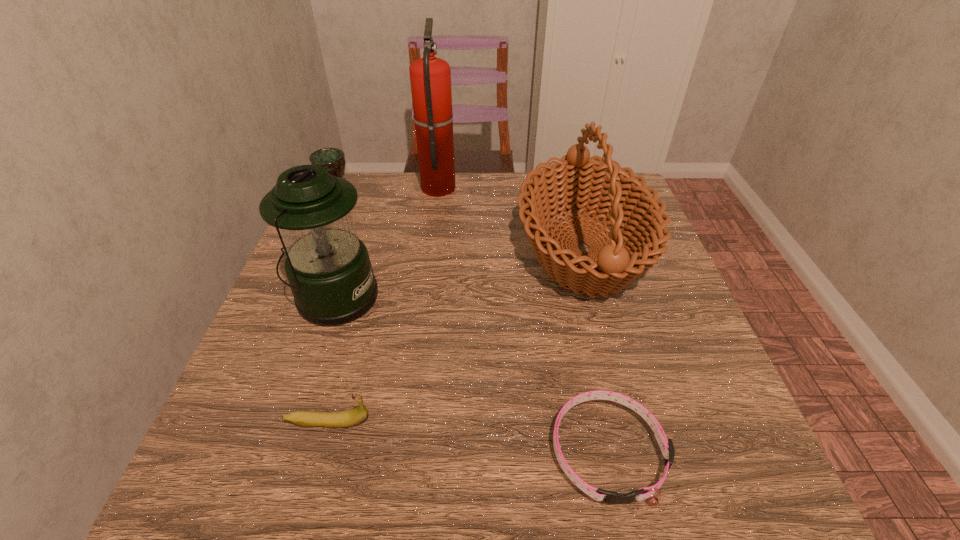
Find the location of a particular element. This screenshot has width=960, height=540. free space that is in between the chalice and the basket is located at coordinates (461, 226).

Identify the location of free space that is in between the shortest object and the banana. (468, 437).

Identify the location of empty location between the second shortest object and the basket. Image resolution: width=960 pixels, height=540 pixels. (456, 336).

This screenshot has height=540, width=960. I want to click on free point between the shortest object and the lantern, so click(471, 374).

Locate an element on the screen. Image resolution: width=960 pixels, height=540 pixels. vacant area that lies between the shortest object and the basket is located at coordinates pos(595,350).

At what (x,y) coordinates should I click in order to perform the action: click on unoccupied position between the fourth object from left to right and the basket. Please return your answer as a coordinate pair (x, y). The height and width of the screenshot is (540, 960). Looking at the image, I should click on (511, 218).

Choose which object is the fifth nearest neighbor to the banana. Please provide its 2D coordinates. Your answer should be formatted as a tuple, i.e. [(x, y)], where the tuple contains the x and y coordinates of a point satisfying the conditions above.

[(430, 77)]

Choose which object is the fourth nearest neighbor to the lantern. Please provide its 2D coordinates. Your answer should be formatted as a tuple, i.e. [(x, y)], where the tuple contains the x and y coordinates of a point satisfying the conditions above.

[(574, 183)]

Image resolution: width=960 pixels, height=540 pixels. Find the location of `free spot that satisfies the following two spatial constraints: 1. on the back side of the lantern; 2. on the left side of the basket`. free spot that satisfies the following two spatial constraints: 1. on the back side of the lantern; 2. on the left side of the basket is located at coordinates (350, 250).

The width and height of the screenshot is (960, 540). In order to click on vacant region that satisfies the following two spatial constraints: 1. on the back side of the basket; 2. on the right side of the lantern in this screenshot , I will do `click(350, 250)`.